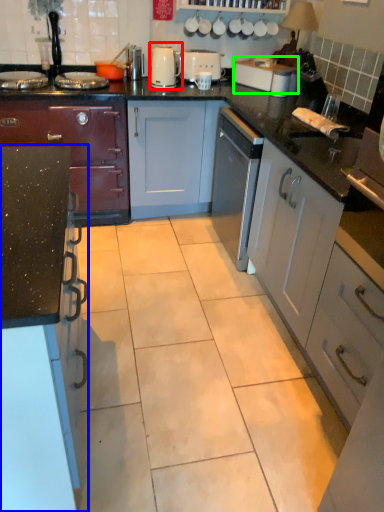
Question: Estimate the real-world distances between objects in this image. Which object is closer to kitchen appliance (highlighted by a red box), cabinetry (highlighted by a blue box) or toaster (highlighted by a green box)?

Choices:
 (A) cabinetry
 (B) toaster

Answer: (B)